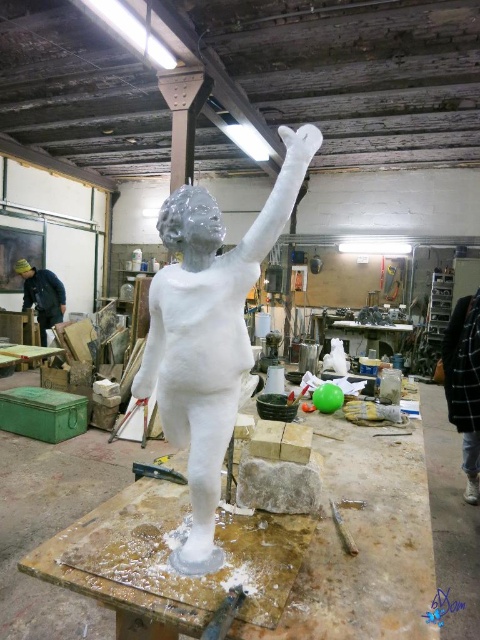
Question: Does black checkered jacket at right have a smaller size compared to matte black jacket at left?

Choices:
 (A) no
 (B) yes

Answer: (B)

Question: Among these points, which one is nearest to the camera?

Choices:
 (A) (452, 339)
 (B) (202, 481)

Answer: (B)

Question: Which object is positioned closest to the black checkered jacket at right?

Choices:
 (A) matte black jacket at left
 (B) metallic silver tool at lower center
 (C) white matte statue at center

Answer: (B)

Question: Estimate the real-world distances between objects in this image. Which object is closer to the metallic silver tool at lower center?

Choices:
 (A) white matte statue at center
 (B) black checkered jacket at right

Answer: (A)

Question: Does white matte statue at center come in front of matte black jacket at left?

Choices:
 (A) yes
 (B) no

Answer: (A)

Question: Can you confirm if black checkered jacket at right is positioned to the left of matte black jacket at left?

Choices:
 (A) yes
 (B) no

Answer: (B)